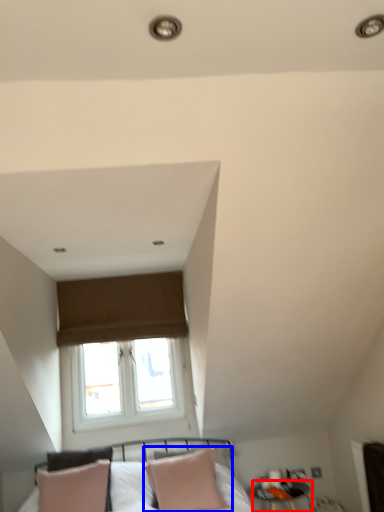
Question: Which of the following is the closest to the observer, side table (highlighted by a red box) or pillow (highlighted by a blue box)?

Choices:
 (A) side table
 (B) pillow

Answer: (B)